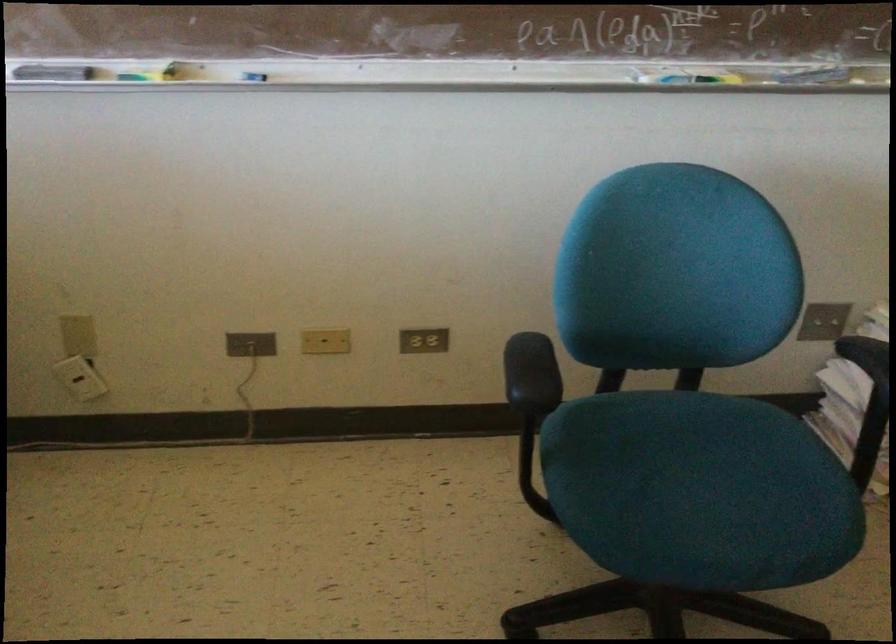
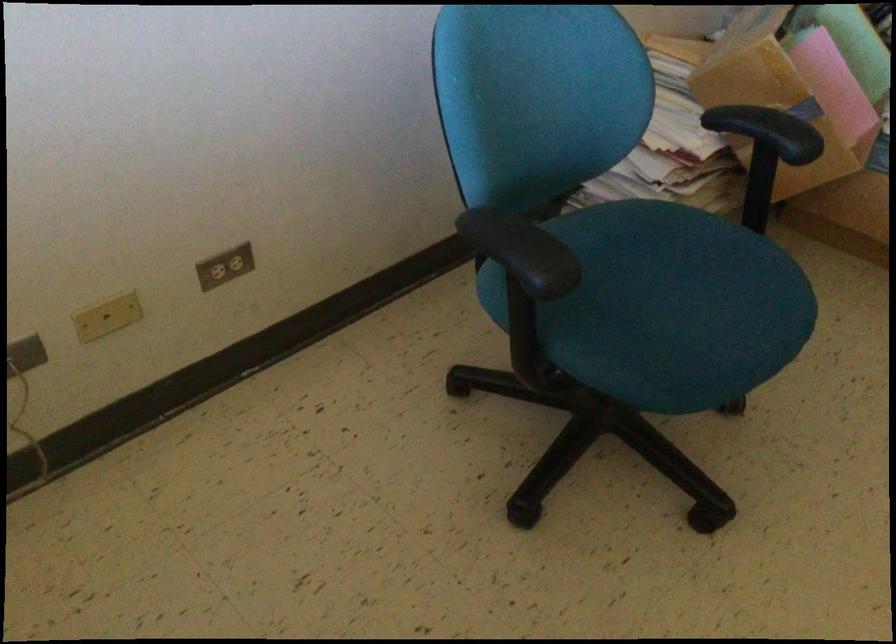
First-person continuous shooting, in which direction is the camera rotating?

The camera rotated toward right-down.